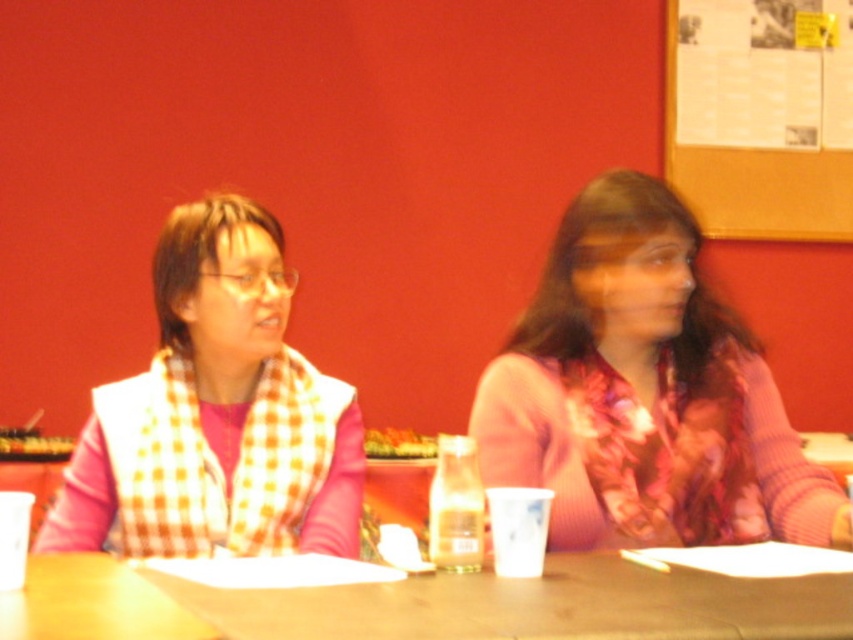
You are a photographer setting up for a group photo. The checkered scarf at left and the corkboard at upper right are in your frame. Which object is closer to the bottom edge of the photo?

The checkered scarf at left is shorter than the corkboard at upper right, so it is closer to the bottom edge of the photo.